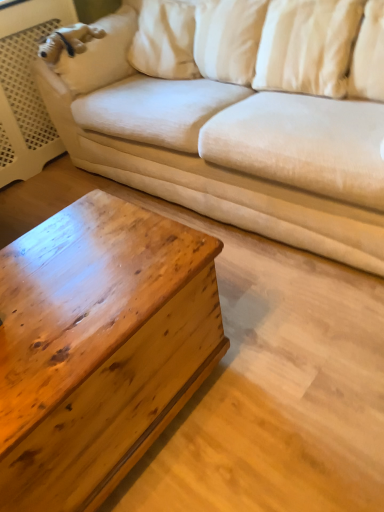
Question: Is white soft pillow at upper right, the first pillow viewed from the right, wider than white soft pillow at upper right, which appears as the 2th pillow when viewed from the right?

Choices:
 (A) yes
 (B) no

Answer: (B)

Question: Does white soft pillow at upper right, which ranks as the 2th pillow in left-to-right order, lie behind white soft pillow at upper right, which appears as the 2th pillow when viewed from the right?

Choices:
 (A) no
 (B) yes

Answer: (A)

Question: Would you say white soft pillow at upper right, which appears as the 2th pillow when viewed from the right, is part of white soft pillow at upper right, which ranks as the 2th pillow in left-to-right order,'s contents?

Choices:
 (A) no
 (B) yes

Answer: (A)

Question: Considering the relative positions of white soft pillow at upper right, which ranks as the 2th pillow in left-to-right order, and white soft pillow at upper right, which appears as the 1th pillow when viewed from the left, in the image provided, is white soft pillow at upper right, which ranks as the 2th pillow in left-to-right order, in front of white soft pillow at upper right, which appears as the 1th pillow when viewed from the left,?

Choices:
 (A) yes
 (B) no

Answer: (A)

Question: From a real-world perspective, is white soft pillow at upper right, the first pillow viewed from the right, physically below white soft pillow at upper right, which appears as the 2th pillow when viewed from the right?

Choices:
 (A) no
 (B) yes

Answer: (A)

Question: From the image's perspective, is white soft pillow at upper right, which ranks as the 2th pillow in left-to-right order, under white soft pillow at upper right, which appears as the 1th pillow when viewed from the left?

Choices:
 (A) no
 (B) yes

Answer: (B)

Question: Can you confirm if wooden chestnut coffee table at lower left is positioned to the right of white soft pillow at upper right, the first pillow viewed from the right?

Choices:
 (A) yes
 (B) no

Answer: (B)

Question: Is wooden chestnut coffee table at lower left next to white soft pillow at upper right, which ranks as the 2th pillow in left-to-right order, and touching it?

Choices:
 (A) no
 (B) yes

Answer: (A)

Question: Can you confirm if wooden chestnut coffee table at lower left is thinner than white soft pillow at upper right, the first pillow viewed from the right?

Choices:
 (A) yes
 (B) no

Answer: (B)

Question: From a real-world perspective, is wooden chestnut coffee table at lower left on top of white soft pillow at upper right, which ranks as the 2th pillow in left-to-right order?

Choices:
 (A) yes
 (B) no

Answer: (B)

Question: Considering the relative positions of wooden chestnut coffee table at lower left and white soft pillow at upper right, the first pillow viewed from the right, in the image provided, is wooden chestnut coffee table at lower left to the left of white soft pillow at upper right, the first pillow viewed from the right, from the viewer's perspective?

Choices:
 (A) no
 (B) yes

Answer: (B)

Question: Is wooden chestnut coffee table at lower left facing towards white soft pillow at upper right, the first pillow viewed from the right?

Choices:
 (A) yes
 (B) no

Answer: (B)

Question: Can you confirm if beige fabric couch at upper center is positioned to the left of white soft pillow at upper right, the first pillow viewed from the right?

Choices:
 (A) no
 (B) yes

Answer: (B)